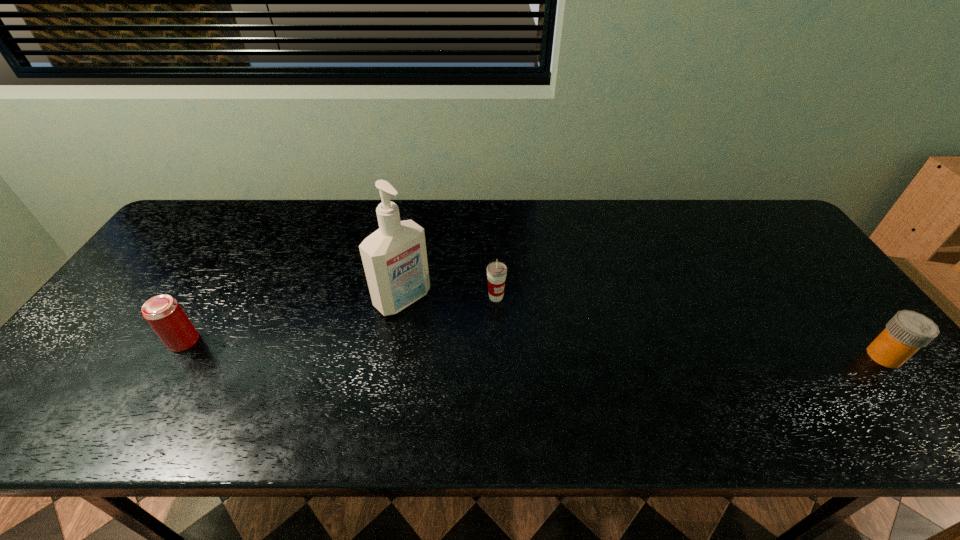
Find the location of a particular element. free area in between the cup and the cleansing agent is located at coordinates (449, 298).

The image size is (960, 540). I want to click on vacant space in between the second object from right to left and the cleansing agent, so click(x=449, y=298).

In order to click on free area in between the tallest object and the beer can in this screenshot , I will do `click(293, 320)`.

Image resolution: width=960 pixels, height=540 pixels. What are the coordinates of `empty space that is in between the rightmost object and the beer can` in the screenshot? It's located at (534, 348).

This screenshot has width=960, height=540. I want to click on vacant area that lies between the medicine and the tallest object, so click(x=643, y=328).

Identify the location of free spot between the cleansing agent and the beer can. This screenshot has height=540, width=960. (293, 320).

Where is `vacant area between the cup and the rightmost object`? vacant area between the cup and the rightmost object is located at coordinates (690, 327).

The height and width of the screenshot is (540, 960). I want to click on vacant space that is in between the beer can and the cup, so click(x=340, y=319).

The image size is (960, 540). Find the location of `vacant space that's between the third object from right to left and the beer can`. vacant space that's between the third object from right to left and the beer can is located at coordinates (293, 320).

The width and height of the screenshot is (960, 540). In order to click on object that is the third nearest to the second object from right to left in this screenshot , I will do `click(907, 331)`.